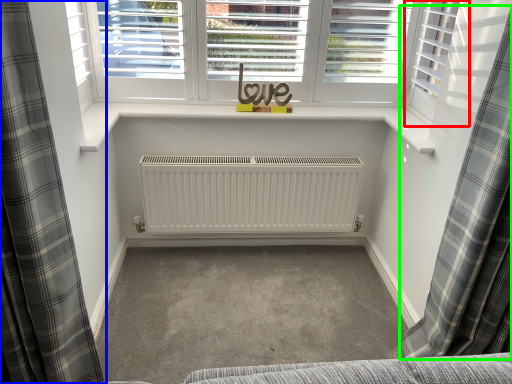
Question: Considering the real-world distances, which object is closest to shutter (highlighted by a red box)? curtain (highlighted by a blue box) or curtain (highlighted by a green box).

Choices:
 (A) curtain
 (B) curtain

Answer: (B)